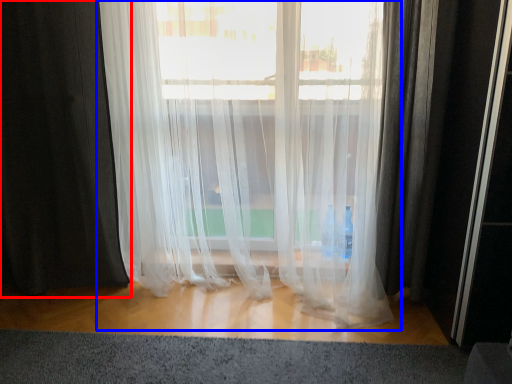
Question: Which of the following is the farthest to the observer, curtain (highlighted by a red box) or curtain (highlighted by a blue box)?

Choices:
 (A) curtain
 (B) curtain

Answer: (A)